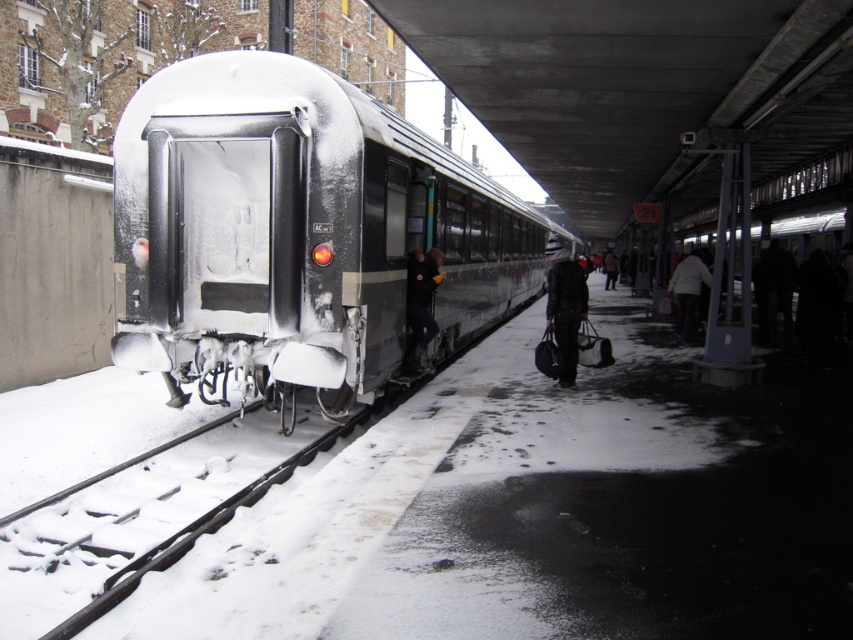
Question: Is silver metallic train at center wider than snow-covered metal track at lower left?

Choices:
 (A) no
 (B) yes

Answer: (B)

Question: Which is nearer to the dark blue jacket at center?

Choices:
 (A) snow-covered metal track at lower left
 (B) silver metallic train at center
 (C) dark brown leather jacket at center

Answer: (A)

Question: Can you confirm if dark fabric coat at lower right is smaller than dark blue jacket at center?

Choices:
 (A) yes
 (B) no

Answer: (B)

Question: Which object appears farthest from the camera in this image?

Choices:
 (A) dark brown leather jacket at center
 (B) black leather jacket at center

Answer: (A)

Question: Considering the real-world distances, which object is farthest from the black leather jacket at center?

Choices:
 (A) dark blue jacket at center
 (B) dark fabric coat at lower right
 (C) snow-covered metal track at lower left
 (D) silver metallic train at center

Answer: (D)

Question: Is silver metallic train at center below dark blue jacket at center?

Choices:
 (A) no
 (B) yes

Answer: (A)